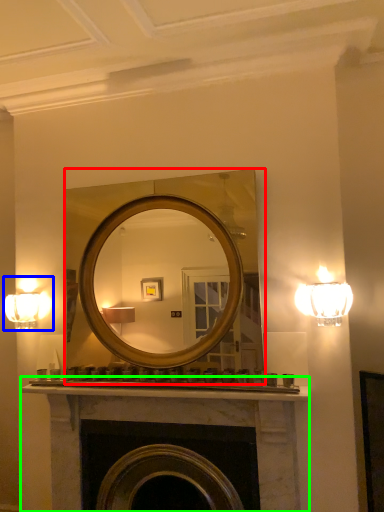
Question: Based on their relative distances, which object is farther from mirror (highlighted by a red box)? Choose from fixture (highlighted by a blue box) and fireplace (highlighted by a green box).

Choices:
 (A) fixture
 (B) fireplace

Answer: (B)